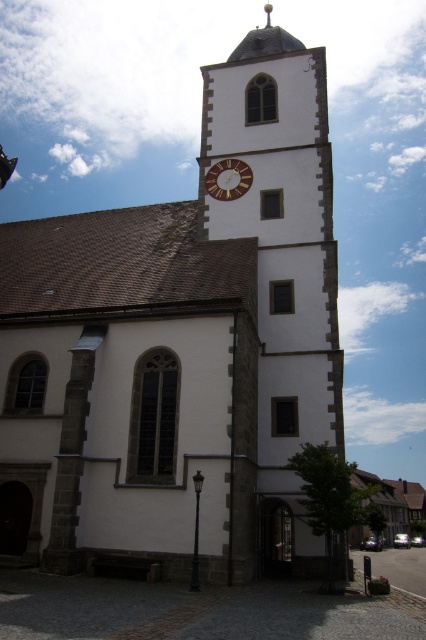
You are standing in front of the church and notice both the white stone clock tower at center and the gold metallic clock at center. Which one is positioned to the right side?

The white stone clock tower at center is to the right of the gold metallic clock at center.

You are an architect analyzing the church structure. You notice the white stone clock tower at center and the gold metallic clock at center. Which object is bigger in size?

The white stone clock tower at center is larger in size than the gold metallic clock at center.